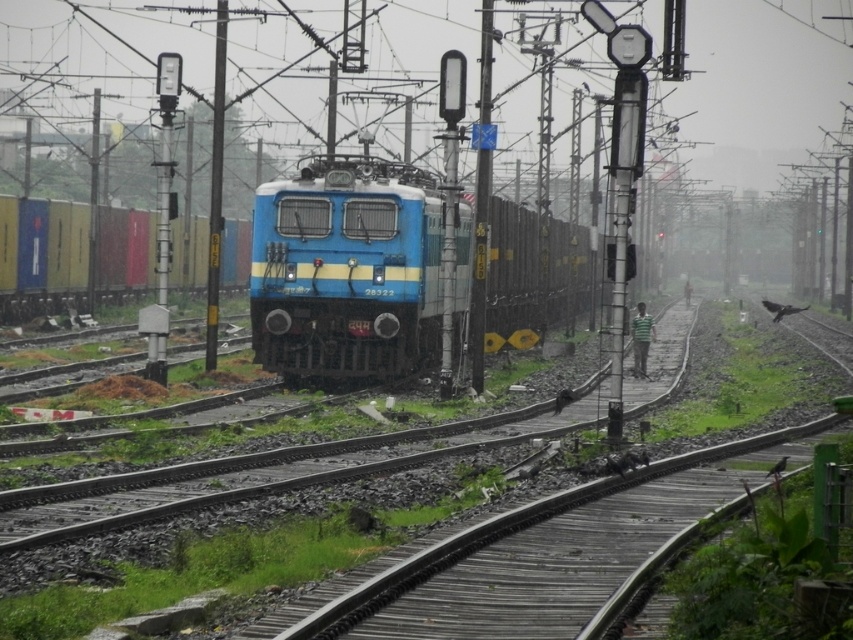
You are standing at the position of the viewer in the image. The blue matte train at center is approaching you. If the train is moving at 15 km per hour, how many seconds do you have until it reaches you?

The blue matte train at center and viewer are 23.19 meters apart. At 15 km per hour, the train travels at approximately 4.17 meters per second. Dividing the distance by speed gives 23.19 meters divided by 4.17 mps equals roughly 5.56 seconds. So, you have about 5.6 seconds before the train reaches you.

Looking at this image, you are a passenger on the train and want to see the person walking on the wooden walkway. Is the blue glossy locomotive at center blocking your view of the wooden at center?

The blue glossy locomotive at center is above the wooden at center, so it is blocking your view of the wooden at center.